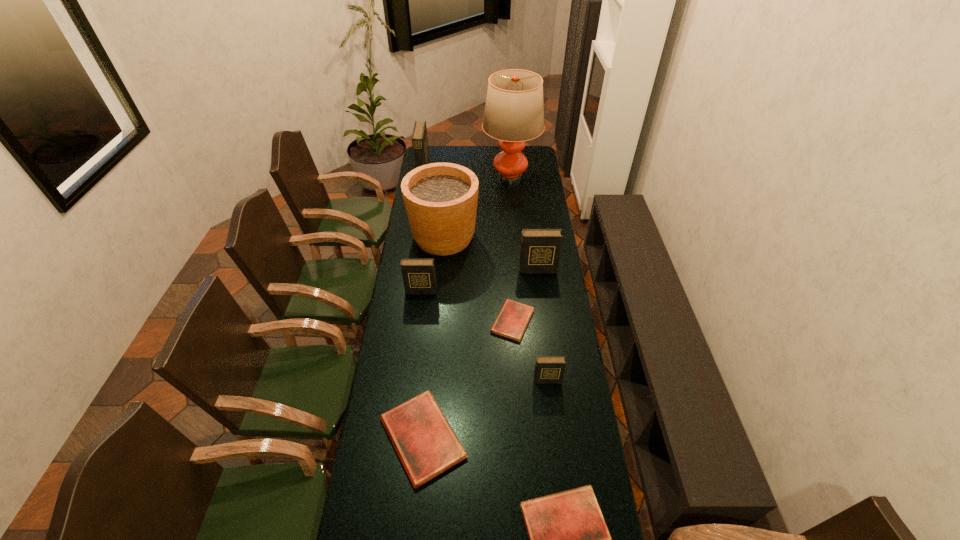
Identify the location of vacant region at the right edge. Image resolution: width=960 pixels, height=540 pixels. (568, 402).

The width and height of the screenshot is (960, 540). I want to click on free space at the far left corner of the desktop, so click(431, 148).

Where is `vacant position at the far right corner of the desktop`? The height and width of the screenshot is (540, 960). vacant position at the far right corner of the desktop is located at coordinates (527, 153).

Where is `empty space that is in between the smallest dark diary and the third biggest dark diary`? This screenshot has width=960, height=540. empty space that is in between the smallest dark diary and the third biggest dark diary is located at coordinates (484, 336).

Find the location of a particular element. This screenshot has width=960, height=540. vacant area that lies between the fourth tallest diary and the orange lamp is located at coordinates (529, 278).

The image size is (960, 540). I want to click on free space between the flowerpot and the sixth shortest object, so pos(491,253).

Find the location of a particular element. free area in between the biggest red diary and the sixth shortest object is located at coordinates (480, 354).

This screenshot has width=960, height=540. I want to click on free spot between the farthest diary and the smallest dark diary, so click(x=485, y=276).

Find the location of `unoccupied position between the nearest dark diary and the seventh nearest object`. unoccupied position between the nearest dark diary and the seventh nearest object is located at coordinates (495, 308).

Where is `object that can be found as the second closest to the farthest diary`? This screenshot has width=960, height=540. object that can be found as the second closest to the farthest diary is located at coordinates (514, 112).